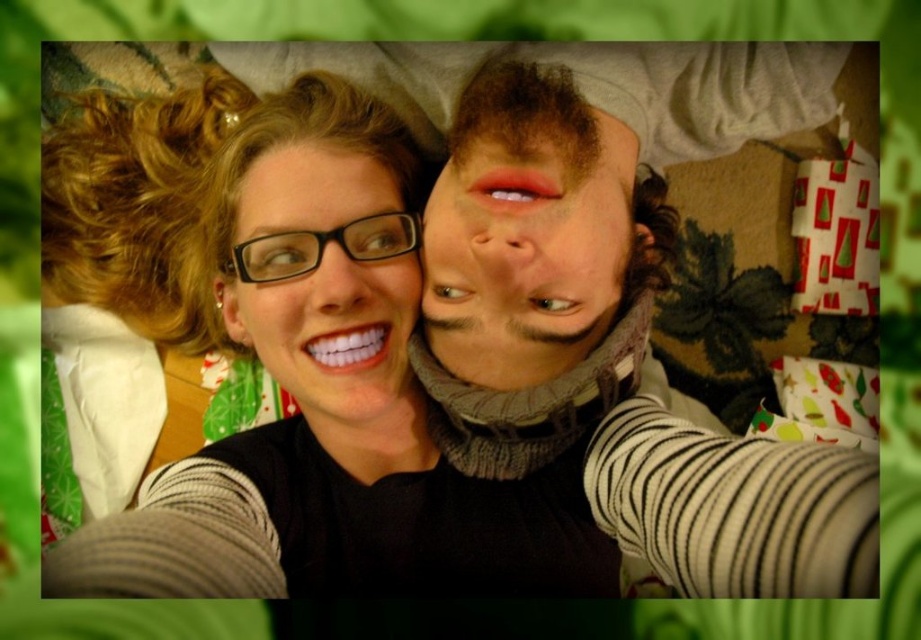
Does matte gray sweater at center have a larger size compared to matte black glasses at center?

Indeed, matte gray sweater at center has a larger size compared to matte black glasses at center.

Is matte gray sweater at center in front of matte black glasses at center?

Yes, it is in front of matte black glasses at center.

Describe the element at coordinates (526, 228) in the screenshot. I see `matte gray sweater at center` at that location.

You are a GUI agent. You are given a task and a screenshot of the screen. Output one action in this format:
    pyautogui.click(x=<x>, y=<y>)
    Task: Click on the matte gray sweater at center
    
    Given the screenshot: What is the action you would take?
    pyautogui.click(x=526, y=228)

Can you confirm if matte black glasses at upper left is wider than matte black glasses at center?

Indeed, matte black glasses at upper left has a greater width compared to matte black glasses at center.

Image resolution: width=921 pixels, height=640 pixels. What do you see at coordinates (290, 368) in the screenshot?
I see `matte black glasses at upper left` at bounding box center [290, 368].

The image size is (921, 640). What are the coordinates of `matte black glasses at upper left` in the screenshot? It's located at (290, 368).

Is matte black glasses at upper left closer to the viewer compared to matte gray sweater at center?

Yes, it is.

Based on the photo, is matte black glasses at upper left above matte gray sweater at center?

Actually, matte black glasses at upper left is below matte gray sweater at center.

Does point (391, 499) come closer to viewer compared to point (632, 177)?

No, (391, 499) is behind (632, 177).

Where is `matte black glasses at upper left`? matte black glasses at upper left is located at coordinates (290, 368).